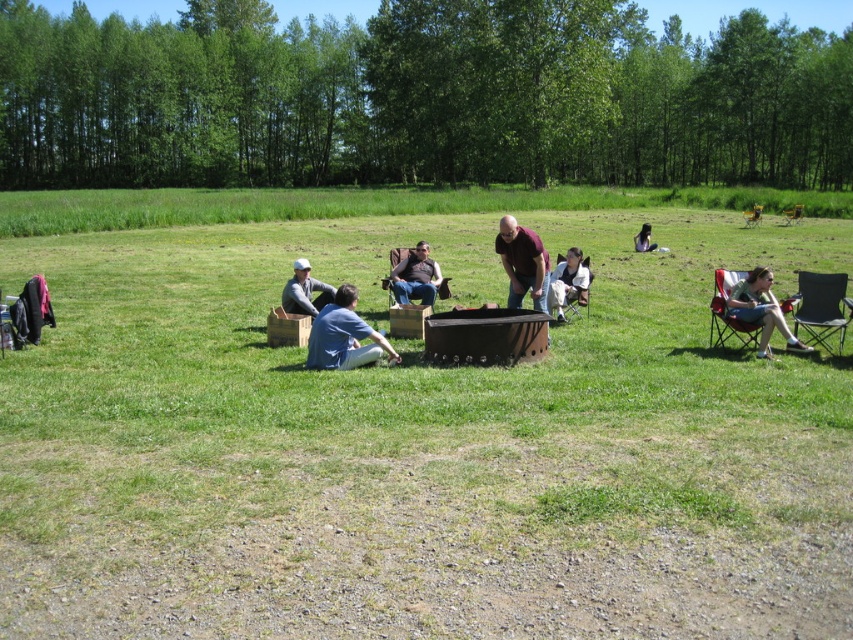
You are planning to set up a tent near the black matte fire pit at center and the yellow fabric chair at right. Since the fire pit is smaller, will it leave enough space for the tent between them?

The black matte fire pit at center occupies less space than the yellow fabric chair at right, so there should be sufficient space between them to set up the tent.

You are standing at the edge of the grassy field and want to sit down. You see the black matte fire pit at center and the black fabric chair at right. Which object is closer to your current position?

The black matte fire pit at center is closer to your current position because it is to the left of the black fabric chair at right, meaning it is positioned between you and the chair.

Looking at this image, you are standing at the fire pit in the center of the group. You want to walk to a specific point in the image. Which of the two points, point (469, 353) or point (796, 211), would you reach first if you walk straight ahead?

You would reach point (469, 353) first because it is closer to the viewer than point (796, 211).